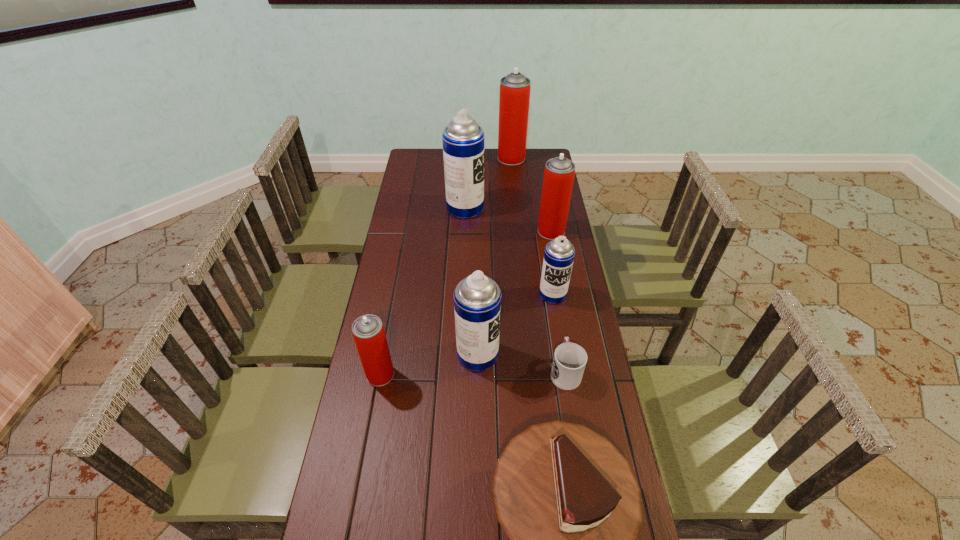
Where is `the fourth farthest aerosol can`? The image size is (960, 540). the fourth farthest aerosol can is located at coordinates (559, 253).

At what (x,y) coordinates should I click in order to perform the action: click on cup. Please return your answer as a coordinate pair (x, y). Image resolution: width=960 pixels, height=540 pixels. Looking at the image, I should click on (569, 362).

Locate an element on the screen. red cup is located at coordinates (569, 362).

This screenshot has width=960, height=540. In order to click on free space located on the label side of the seventh nearest object in this screenshot , I will do `click(564, 208)`.

Where is `free location located on the right of the farthest object`? The height and width of the screenshot is (540, 960). free location located on the right of the farthest object is located at coordinates (546, 158).

At what (x,y) coordinates should I click in order to perform the action: click on free space located on the front of the second nearest red aerosol can. Please return your answer as a coordinate pair (x, y). This screenshot has width=960, height=540. Looking at the image, I should click on (558, 267).

Find the location of a particular element. This screenshot has height=540, width=960. free space located 0.120m on the label side of the second smallest blue aerosol can is located at coordinates (536, 354).

Locate an element on the screen. free space located on the back of the leftmost aerosol can is located at coordinates (392, 314).

Find the location of a particular element. The height and width of the screenshot is (540, 960). vacant space situated 0.110m on the label side of the second nearest blue aerosol can is located at coordinates (559, 329).

At what (x,y) coordinates should I click in order to perform the action: click on vacant space located 0.150m on the side of the cup where the handle is located. Please return your answer as a coordinate pair (x, y). Image resolution: width=960 pixels, height=540 pixels. Looking at the image, I should click on (557, 317).